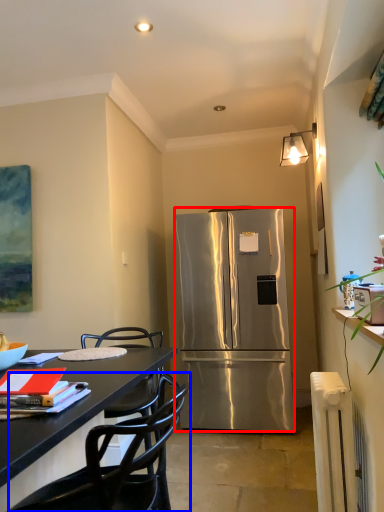
Question: Which of the following is the closest to the observer, refrigerator (highlighted by a red box) or chair (highlighted by a blue box)?

Choices:
 (A) refrigerator
 (B) chair

Answer: (B)